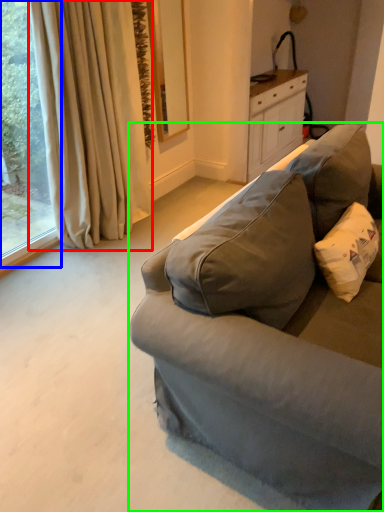
Question: Which object is the farthest from curtain (highlighted by a red box)? Choose among these: window (highlighted by a blue box) or studio couch (highlighted by a green box).

Choices:
 (A) window
 (B) studio couch

Answer: (B)